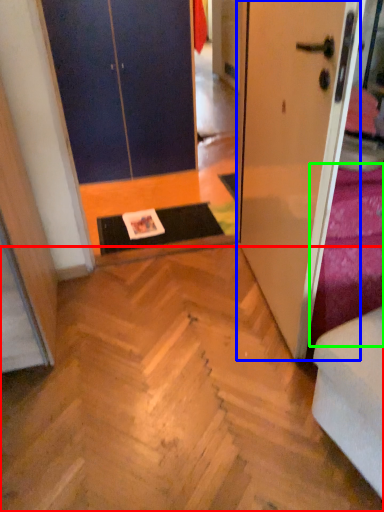
Question: Which object is the farthest from stairwell (highlighted by a red box)? Choose among these: door (highlighted by a blue box) or bedding (highlighted by a green box).

Choices:
 (A) door
 (B) bedding

Answer: (A)